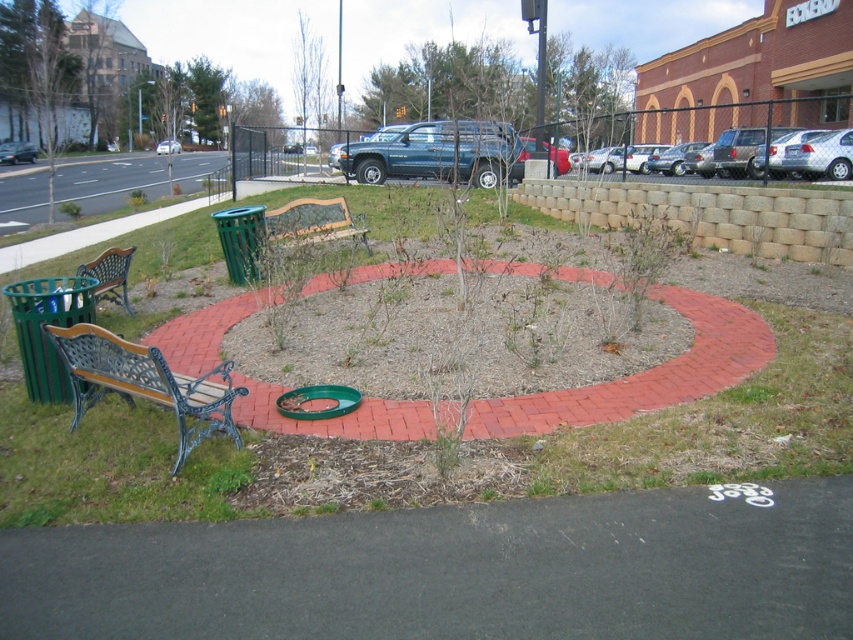
You are standing at the point with coordinates point (119, 362) and want to walk towards the point with coordinates point (56, 416). Which direction should you move to get closer to your destination?

Since point (56, 416) is further to the camera than point (119, 362), you should move forward to get closer to your destination.

You are a maintenance worker who needs to reach the green grass at lower left to mow it. The wooden bench at center is in your way. Can you move the bench to access the grass?

The green grass at lower left is located below the wooden bench at center, so you cannot move the bench to access the grass because the grass is already underneath it.

You are a maintenance worker who needs to mow the green grass at lower left. Can you access it from the wooden bench at lower left without stepping on the grass?

The green grass at lower left is above the wooden bench at lower left, so you can access the grass by approaching from below the bench without stepping on it.